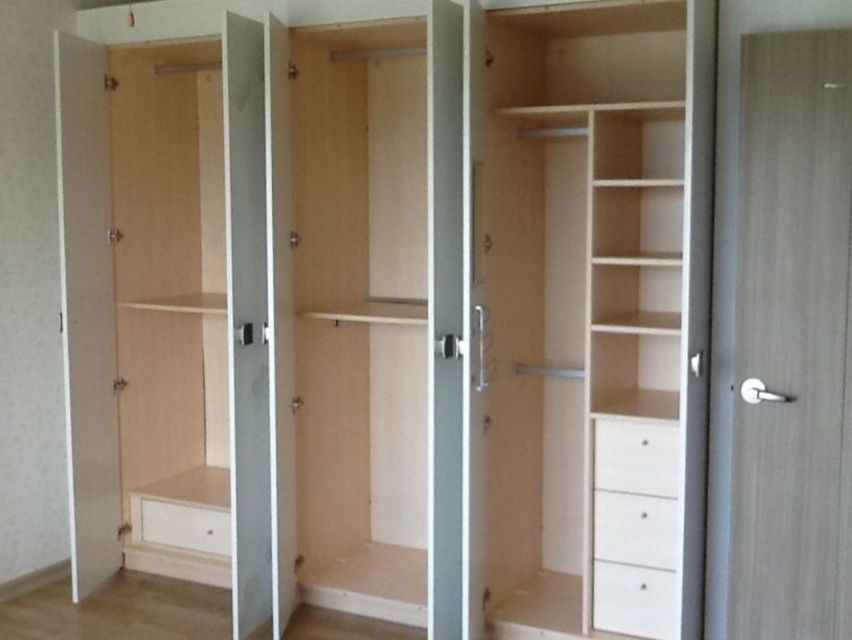
Question: Which of the following is the farthest from the observer?

Choices:
 (A) light wood cabinet at center
 (B) white matte drawer at lower right
 (C) white wood drawer at lower right
 (D) white matte drawer at lower left

Answer: (D)

Question: Which object is positioned closest to the light wood cabinet at center?

Choices:
 (A) white wood drawer at lower right
 (B) white matte drawer at lower center
 (C) white matte drawer at lower right

Answer: (C)

Question: Is white matte drawer at lower center closer to camera compared to white matte drawer at lower left?

Choices:
 (A) yes
 (B) no

Answer: (A)

Question: Does light wood cabinet at center have a larger size compared to white matte drawer at lower right?

Choices:
 (A) no
 (B) yes

Answer: (B)

Question: Which point is farther from the camera taking this photo?

Choices:
 (A) (165, 536)
 (B) (545, 337)

Answer: (A)

Question: Is white matte drawer at lower center closer to the viewer compared to white matte drawer at lower left?

Choices:
 (A) no
 (B) yes

Answer: (B)